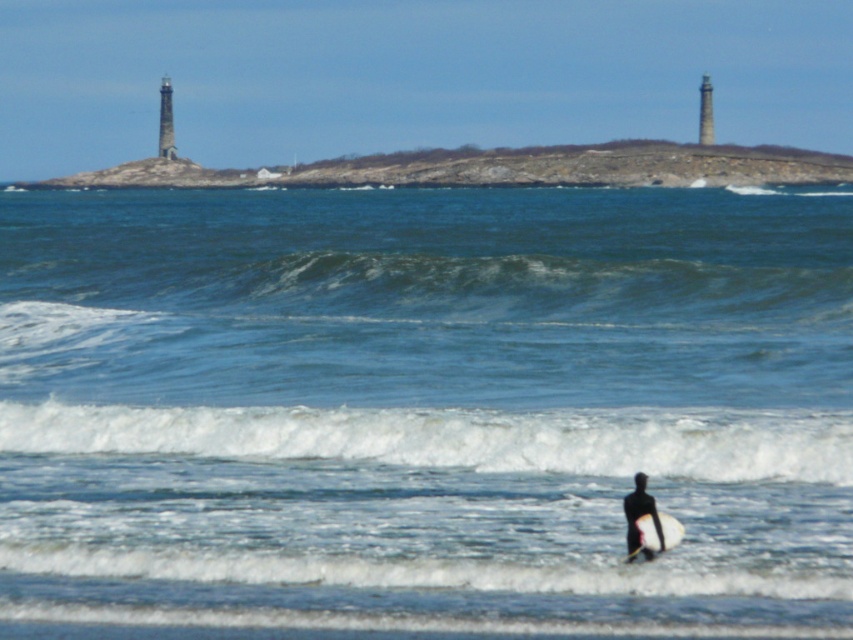
Does blue water at center appear under white foam surfboard at lower center?

Actually, blue water at center is above white foam surfboard at lower center.

Which is in front, point (675, 248) or point (680, 524)?

Positioned in front is point (680, 524).

This screenshot has width=853, height=640. I want to click on blue water at center, so click(422, 412).

Is point (74, 451) behind point (669, 516)?

That is True.

How distant is white foamy wave at lower center from white foam surfboard at lower center?

white foamy wave at lower center is 5.38 meters from white foam surfboard at lower center.

Describe the element at coordinates (456, 438) in the screenshot. I see `white foamy wave at lower center` at that location.

At what (x,y) coordinates should I click in order to perform the action: click on white foamy wave at lower center. Please return your answer as a coordinate pair (x, y). Looking at the image, I should click on (456, 438).

Is blue water at center shorter than white foamy wave at lower center?

No.

Where is `blue water at center`? This screenshot has height=640, width=853. blue water at center is located at coordinates (422, 412).

Between point (357, 624) and point (239, 444), which one is positioned behind?

Point (239, 444)

Where is `blue water at center`? The height and width of the screenshot is (640, 853). blue water at center is located at coordinates (422, 412).